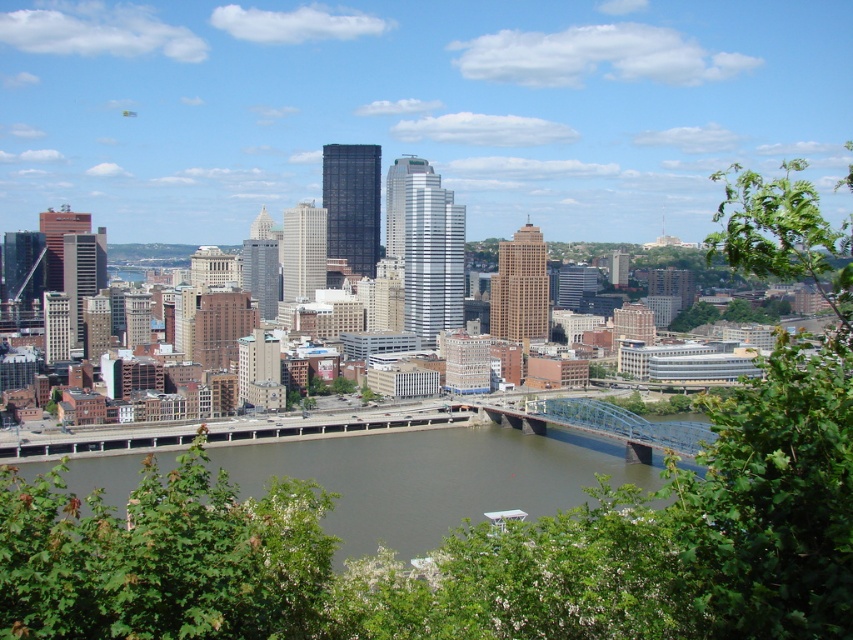
Question: Is brown concrete river at center closer to the viewer compared to blue metallic bridge at center?

Choices:
 (A) yes
 (B) no

Answer: (A)

Question: Which point is farther to the camera?

Choices:
 (A) brown concrete river at center
 (B) blue metallic bridge at center

Answer: (B)

Question: Which object is closer to the camera taking this photo?

Choices:
 (A) blue metallic bridge at center
 (B) brown concrete river at center

Answer: (B)

Question: Can you confirm if brown concrete river at center is thinner than blue metallic bridge at center?

Choices:
 (A) no
 (B) yes

Answer: (A)

Question: Observing the image, what is the correct spatial positioning of brown concrete river at center in reference to blue metallic bridge at center?

Choices:
 (A) below
 (B) above

Answer: (A)

Question: Among these points, which one is farthest from the camera?

Choices:
 (A) (527, 504)
 (B) (622, 420)

Answer: (B)